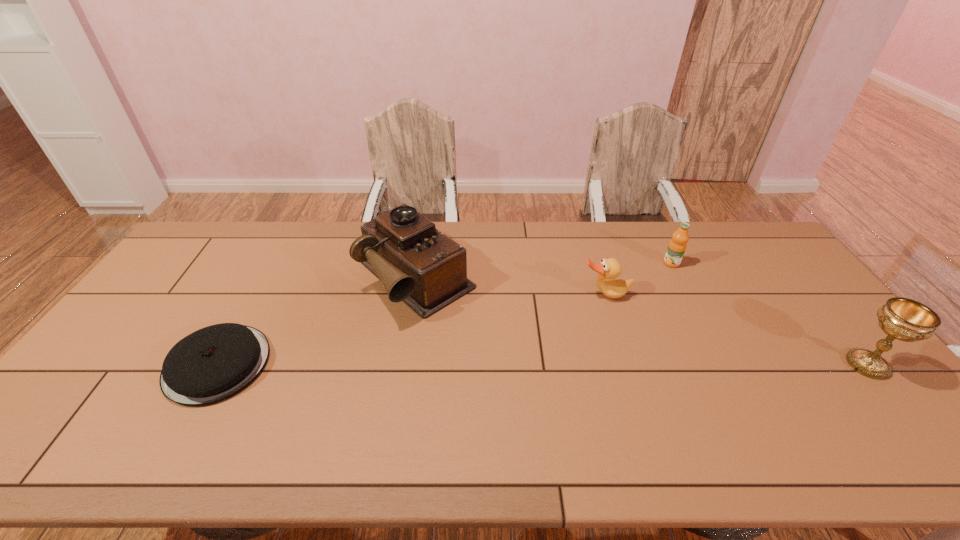
Where is `the leftmost object`? the leftmost object is located at coordinates (214, 363).

The height and width of the screenshot is (540, 960). In order to click on pancake in this screenshot , I will do `click(214, 363)`.

At what (x,y) coordinates should I click in order to perform the action: click on chalice. Please return your answer as a coordinate pair (x, y). Looking at the image, I should click on (901, 318).

Locate an element on the screen. duck is located at coordinates (610, 268).

Locate an element on the screen. the second object from left to right is located at coordinates (417, 264).

You are a GUI agent. You are given a task and a screenshot of the screen. Output one action in this format:
    pyautogui.click(x=<x>, y=<y>)
    Task: Click on the fourth object from left to right
    Image resolution: width=960 pixels, height=540 pixels.
    Given the screenshot: What is the action you would take?
    pyautogui.click(x=677, y=246)

Image resolution: width=960 pixels, height=540 pixels. Identify the location of free space located on the right of the pancake. (x=286, y=364).

I want to click on free spot located on the left of the chalice, so click(x=695, y=364).

Identify the location of blank space located 0.270m on the beak of the third object from left to right. (637, 375).

This screenshot has height=540, width=960. What are the coordinates of `free region located 0.240m on the beak of the third object from left to right` in the screenshot? It's located at (634, 366).